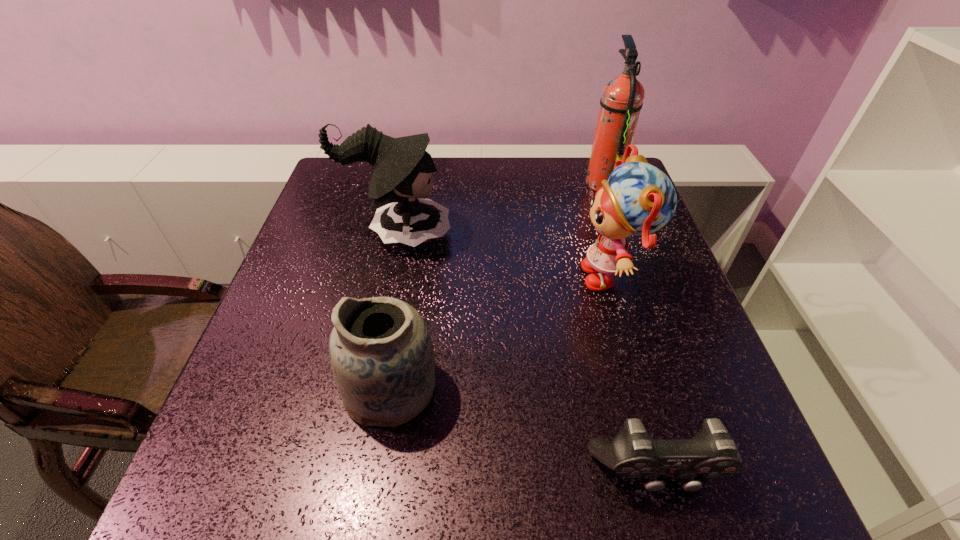
Where is `doll present at the right edge`? This screenshot has height=540, width=960. doll present at the right edge is located at coordinates 638,199.

At what (x,y) coordinates should I click in order to perform the action: click on control that is at the right edge. Please return your answer as a coordinate pair (x, y). The image size is (960, 540). Looking at the image, I should click on (711, 453).

Image resolution: width=960 pixels, height=540 pixels. I want to click on object present at the far right corner, so click(x=622, y=97).

Identify the location of object located at the near right corner. The height and width of the screenshot is (540, 960). (711, 453).

The width and height of the screenshot is (960, 540). Identify the location of free space at the far edge. (567, 180).

The height and width of the screenshot is (540, 960). Identify the location of vacant space at the left edge of the desktop. (270, 385).

Where is `blank space at the right edge of the desktop`? This screenshot has width=960, height=540. blank space at the right edge of the desktop is located at coordinates (655, 289).

Find the location of `free space at the far left corner of the desktop`. free space at the far left corner of the desktop is located at coordinates (330, 203).

Where is `empty location between the control and the right doll`? This screenshot has width=960, height=540. empty location between the control and the right doll is located at coordinates (635, 374).

Where is `vacant area that lies between the tallest object and the fourth farthest object`? vacant area that lies between the tallest object and the fourth farthest object is located at coordinates (497, 285).